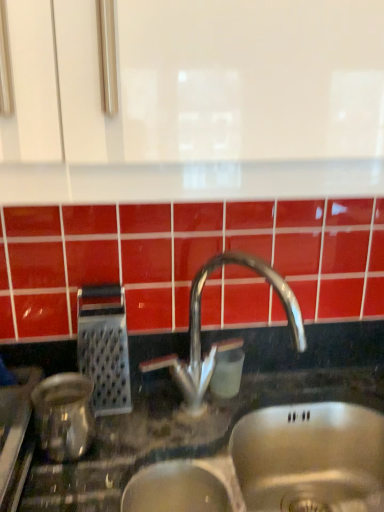
Question: Is metallic grater at left, the 1th appliance viewed from the back, at the left side of shiny metallic kettle at left, the 1th appliance positioned from the front?

Choices:
 (A) yes
 (B) no

Answer: (B)

Question: Does metallic grater at left, which ranks as the second appliance in front-to-back order, have a greater width compared to shiny metallic kettle at left, positioned as the 2th appliance in back-to-front order?

Choices:
 (A) yes
 (B) no

Answer: (B)

Question: Is metallic grater at left, which ranks as the second appliance in front-to-back order, positioned far away from shiny metallic kettle at left, positioned as the 2th appliance in back-to-front order?

Choices:
 (A) no
 (B) yes

Answer: (A)

Question: From a real-world perspective, is metallic grater at left, which ranks as the second appliance in front-to-back order, beneath shiny metallic kettle at left, positioned as the 2th appliance in back-to-front order?

Choices:
 (A) no
 (B) yes

Answer: (A)

Question: From the image's perspective, is metallic grater at left, the 1th appliance viewed from the back, located beneath shiny metallic kettle at left, positioned as the 2th appliance in back-to-front order?

Choices:
 (A) yes
 (B) no

Answer: (B)

Question: Does point (94, 292) appear closer or farther from the camera than point (66, 373)?

Choices:
 (A) farther
 (B) closer

Answer: (A)

Question: Is metallic grater at left, the 1th appliance viewed from the back, taller or shorter than shiny metallic kettle at left, positioned as the 2th appliance in back-to-front order?

Choices:
 (A) short
 (B) tall

Answer: (B)

Question: Is metallic grater at left, the 1th appliance viewed from the back, inside the boundaries of shiny metallic kettle at left, the 1th appliance positioned from the front, or outside?

Choices:
 (A) outside
 (B) inside

Answer: (A)

Question: Considering their positions, is metallic grater at left, the 1th appliance viewed from the back, located in front of or behind shiny metallic kettle at left, the 1th appliance positioned from the front?

Choices:
 (A) front
 (B) behind

Answer: (B)

Question: Considering their positions, is shiny metallic kettle at left, positioned as the 2th appliance in back-to-front order, located in front of or behind polished metallic faucet at center?

Choices:
 (A) front
 (B) behind

Answer: (A)

Question: Considering the relative positions of shiny metallic kettle at left, positioned as the 2th appliance in back-to-front order, and polished metallic faucet at center in the image provided, is shiny metallic kettle at left, positioned as the 2th appliance in back-to-front order, to the left or to the right of polished metallic faucet at center?

Choices:
 (A) right
 (B) left

Answer: (B)

Question: From their relative heights in the image, would you say shiny metallic kettle at left, the 1th appliance positioned from the front, is taller or shorter than polished metallic faucet at center?

Choices:
 (A) short
 (B) tall

Answer: (A)

Question: From the image's perspective, is shiny metallic kettle at left, positioned as the 2th appliance in back-to-front order, located above or below polished metallic faucet at center?

Choices:
 (A) below
 (B) above

Answer: (A)

Question: From a real-world perspective, relative to polished metallic faucet at center, is metallic grater at left, the 1th appliance viewed from the back, vertically above or below?

Choices:
 (A) above
 (B) below

Answer: (B)

Question: In the image, is metallic grater at left, which ranks as the second appliance in front-to-back order, positioned in front of or behind polished metallic faucet at center?

Choices:
 (A) behind
 (B) front

Answer: (A)